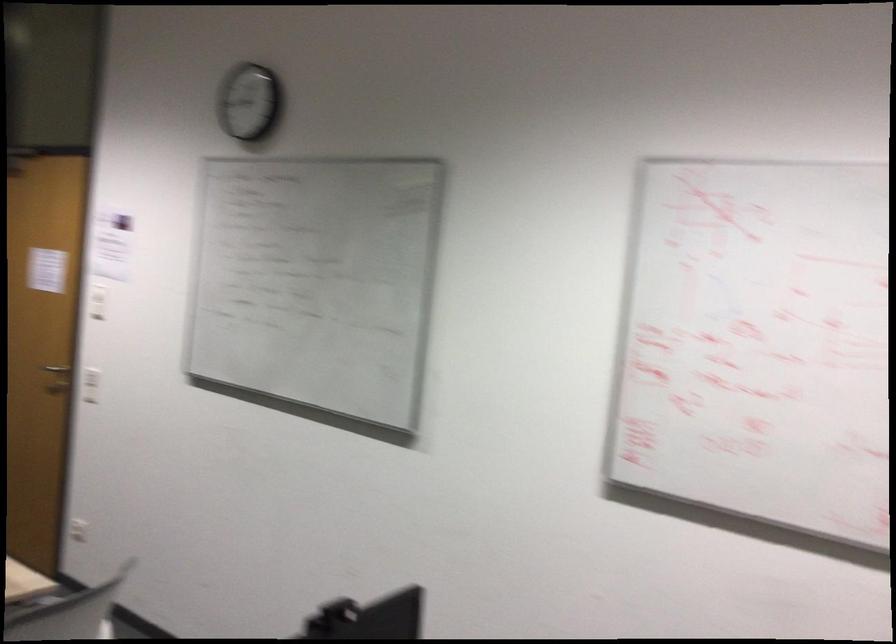
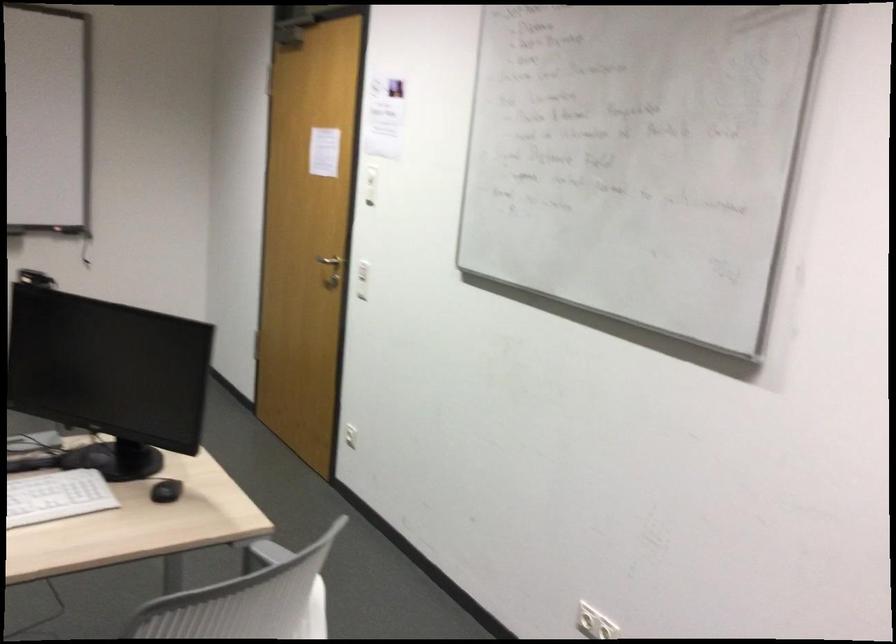
Question: In a continuous first-person perspective shot, in which direction is the camera moving?

Choices:
 (A) Left
 (B) Right
 (C) Forward
 (D) Backward

Answer: (C)